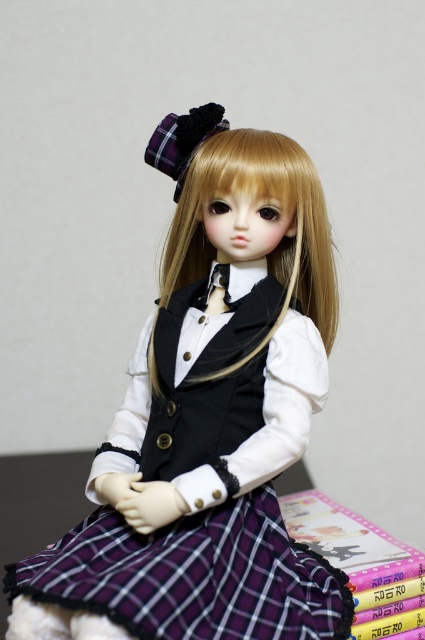
Which of these two, plaid fabric dress at center or plastic book at lower right, stands taller?

With more height is plaid fabric dress at center.

Is point (200, 520) farther from viewer compared to point (376, 566)?

That is False.

The height and width of the screenshot is (640, 425). I want to click on plaid fabric dress at center, so click(209, 422).